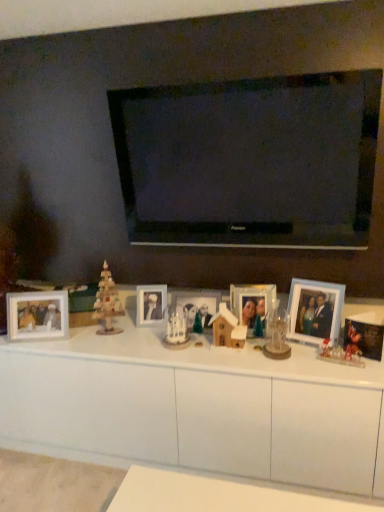
Identify the location of free space in front of metallic mickey mouse photo frame at right, the first picture frame viewed from the right. (362, 369).